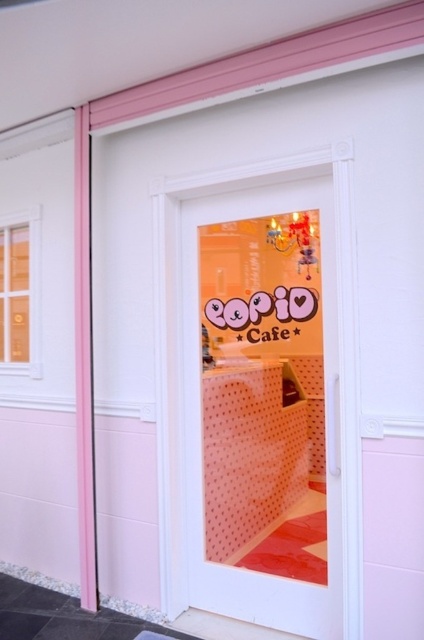
Question: Which point is farther to the camera?

Choices:
 (A) (170, 604)
 (B) (22, 212)

Answer: (B)

Question: Can you confirm if transparent glass door at center is positioned above matte glass window at upper left?

Choices:
 (A) yes
 (B) no

Answer: (B)

Question: Is transparent glass door at center smaller than matte glass window at upper left?

Choices:
 (A) no
 (B) yes

Answer: (A)

Question: Among these objects, which one is nearest to the camera?

Choices:
 (A) transparent glass door at center
 (B) matte glass window at upper left

Answer: (A)

Question: Is transparent glass door at center positioned in front of matte glass window at upper left?

Choices:
 (A) yes
 (B) no

Answer: (A)

Question: Which point is farther to the camera?

Choices:
 (A) transparent glass door at center
 (B) matte glass window at upper left

Answer: (B)